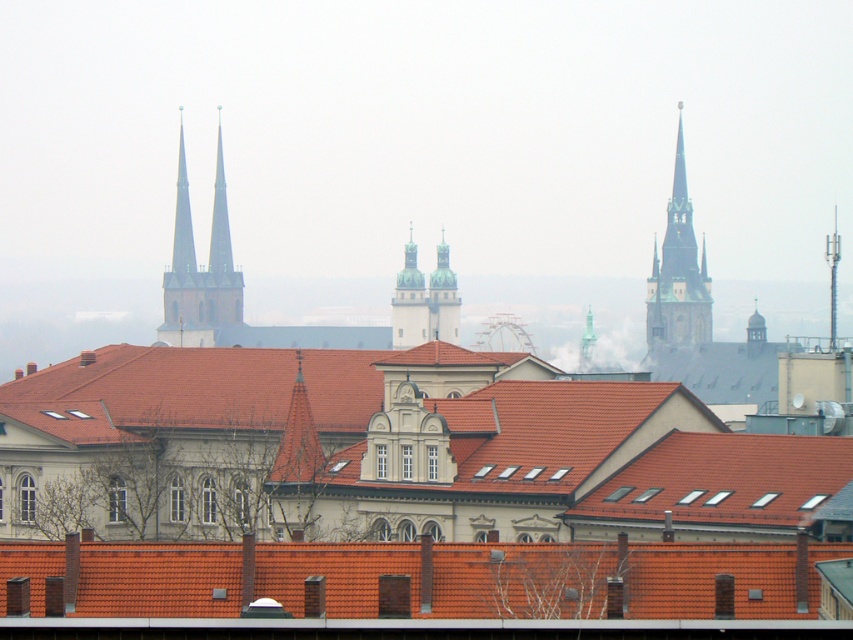
Does orange tiled roof at lower center appear over gold textured spire at center?

No.

Between orange tiled roof at lower center and gold textured spire at center, which one is positioned lower?

orange tiled roof at lower center

At what (x,y) coordinates should I click in order to perform the action: click on orange tiled roof at lower center. Please return your answer as a coordinate pair (x, y). This screenshot has height=640, width=853. Looking at the image, I should click on (416, 579).

Which is above, smooth stone spire at upper right or smooth gray tower at center?

Positioned higher is smooth stone spire at upper right.

In the scene shown: Between smooth stone spire at upper right and smooth gray tower at center, which one appears on the right side from the viewer's perspective?

smooth stone spire at upper right is more to the right.

Who is more distant from viewer, (689, 257) or (416, 301)?

Point (689, 257)

Locate an element on the screen. This screenshot has height=640, width=853. smooth stone spire at upper right is located at coordinates (677, 272).

Can you confirm if smooth stone towers at upper left is taller than smooth gray tower at center?

Correct, smooth stone towers at upper left is much taller as smooth gray tower at center.

Where is `smooth stone towers at upper left`? smooth stone towers at upper left is located at coordinates (199, 269).